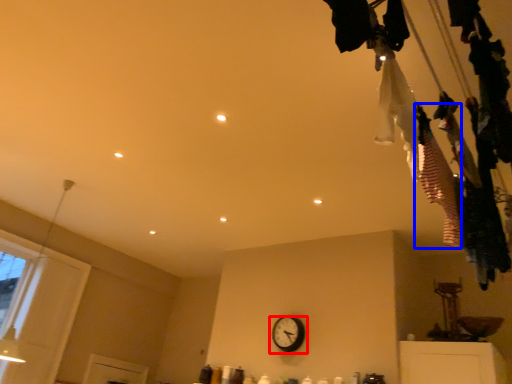
Question: Which object is closer to the camera taking this photo, wall clock (highlighted by a red box) or clothing (highlighted by a blue box)?

Choices:
 (A) wall clock
 (B) clothing

Answer: (B)